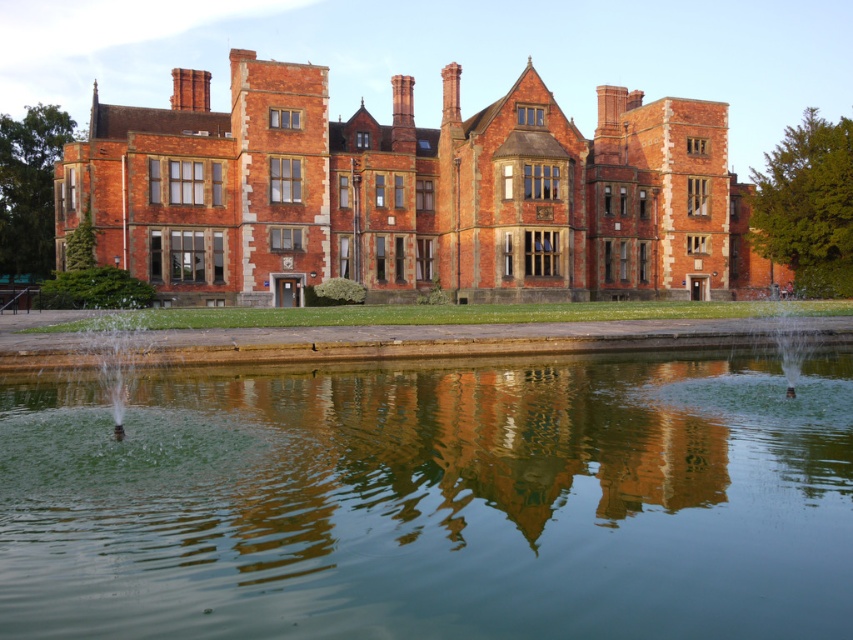
Can you confirm if green reflective water at center is positioned below matte brick mansion at center?

Correct, green reflective water at center is located below matte brick mansion at center.

Does green reflective water at center have a greater width compared to matte brick mansion at center?

In fact, green reflective water at center might be narrower than matte brick mansion at center.

Where is `green reflective water at center`? green reflective water at center is located at coordinates (433, 500).

Is matte brick mansion at center thinner than clear water fountain at lower right?

No.

Can you confirm if matte brick mansion at center is smaller than clear water fountain at lower right?

Incorrect, matte brick mansion at center is not smaller in size than clear water fountain at lower right.

Find the location of `matte brick mansion at center`. matte brick mansion at center is located at coordinates (410, 195).

Who is shorter, green reflective water at center or clear water fountain at lower right?

clear water fountain at lower right

Locate an element on the screen. The image size is (853, 640). green reflective water at center is located at coordinates (433, 500).

I want to click on green reflective water at center, so click(433, 500).